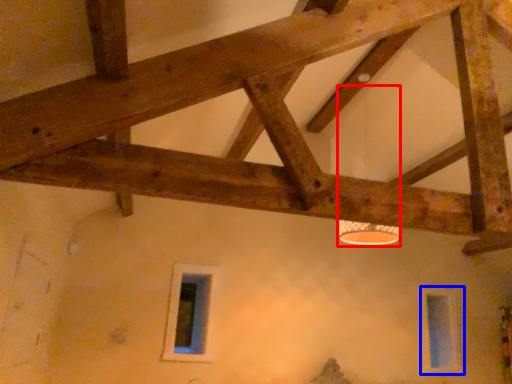
Question: Which of the following is the closest to the observer, lamp (highlighted by a red box) or window (highlighted by a blue box)?

Choices:
 (A) lamp
 (B) window

Answer: (A)